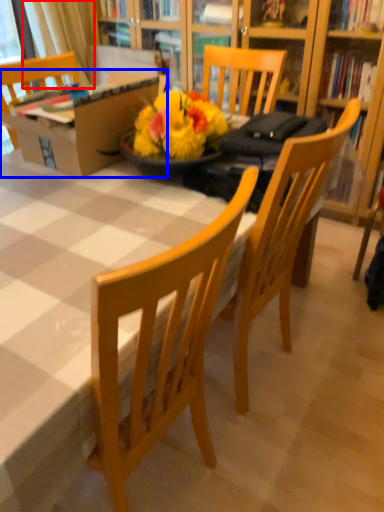
Question: Which point is closer to the camera, curtain (highlighted by a red box) or box (highlighted by a blue box)?

Choices:
 (A) curtain
 (B) box

Answer: (B)